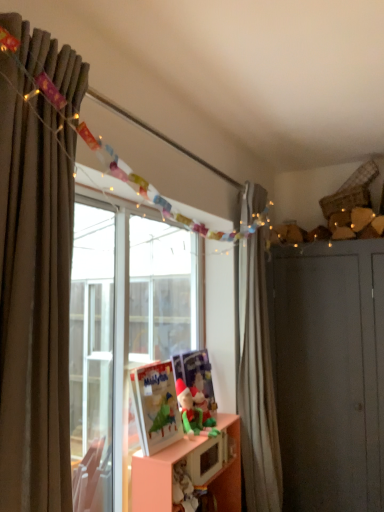
Question: Is point (195, 406) positioned closer to the camera than point (345, 278)?

Choices:
 (A) closer
 (B) farther

Answer: (A)

Question: From their relative heights in the image, would you say green felt santa at center, which is counted as the 2th toy, starting from the back, is taller or shorter than matte gray dresser at right?

Choices:
 (A) tall
 (B) short

Answer: (B)

Question: Which object is the closest to the green plush toy at lower center, which appears as the first toy when viewed from the back?

Choices:
 (A) brown fabric curtain at left, placed as the first curtain when sorted from front to back
 (B) matte gray dresser at right
 (C) green felt santa at center, which is counted as the 2th toy, starting from the back
 (D) matte plastic picture frame at center
 (E) orange matte cabinet at center

Answer: (C)

Question: Which object is the farthest from the white matte curtain at right, arranged as the second curtain when viewed from the front?

Choices:
 (A) green felt santa at center, arranged as the first toy when viewed from the front
 (B) orange matte cabinet at center
 (C) matte gray dresser at right
 (D) matte plastic picture frame at center
 (E) green plush toy at lower center, which is counted as the 2th toy, starting from the front

Answer: (D)